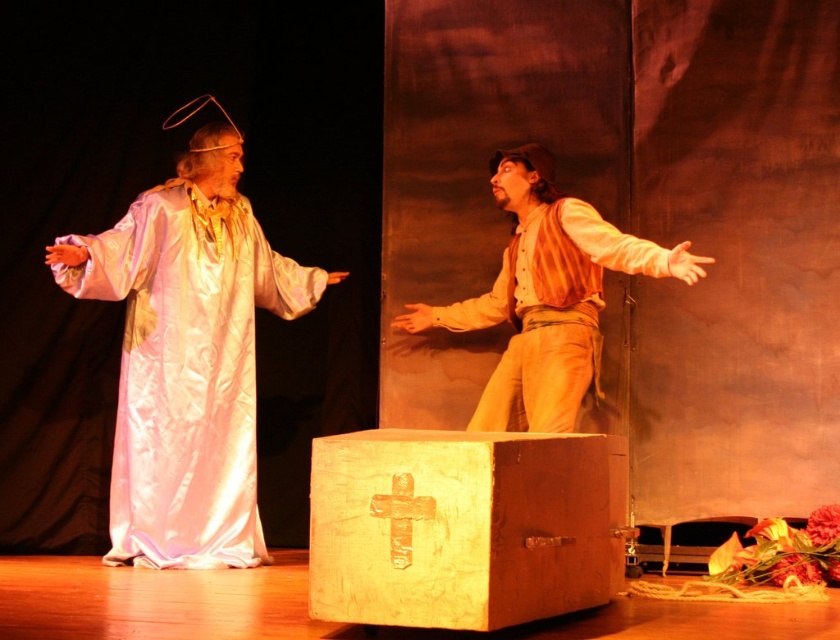
You are a stagehand adjusting the lighting for the play. You need to determine which of the two points, point (192, 344) or point (360, 509), is closer to the camera to ensure proper spotlight placement. Based on the scene, which point is closer?

Point (192, 344) is further to the camera than point (360, 509), so the closer point to the camera is point (360, 509).

You are a stagehand who needs to move the wooden box with cross at center and the matte brown shirt at center offstage. Which object requires more space horizontally to move through the narrow corridor behind the stage?

The matte brown shirt at center requires more horizontal space because it is wider than the wooden box with cross at center.

You are directing a play and want to ensure the actors are arranged properly. Given the current setup with the silky white robe at left and the matte brown shirt at center, which actor is positioned to the right of the other?

The matte brown shirt at center is positioned to the right of the silky white robe at left because the silky white robe at left is on the left side of the matte brown shirt at center.